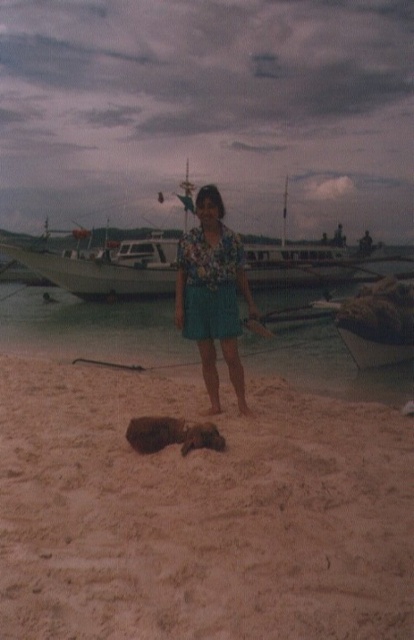
Is brown sandy beach at lower center thinner than sandy beach at center?

Yes.

How distant is brown sandy beach at lower center from sandy beach at center?

34.53 feet

Who is more distant from viewer, (89,531) or (159,324)?

Positioned behind is point (159,324).

You are a GUI agent. You are given a task and a screenshot of the screen. Output one action in this format:
    pyautogui.click(x=<x>, y=<y>)
    Task: Click on the brown sandy beach at lower center
    
    Given the screenshot: What is the action you would take?
    pyautogui.click(x=199, y=515)

In the scene shown: Is brown sandy beach at lower center shorter than white wooden boat at center?

Indeed, brown sandy beach at lower center has a lesser height compared to white wooden boat at center.

Is brown sandy beach at lower center in front of white wooden boat at center?

That is True.

Who is more distant from viewer, (161, 509) or (325, 269)?

Point (325, 269)

Find the location of `brown sandy beach at lower center`. brown sandy beach at lower center is located at coordinates (199, 515).

Is brown sandy beach at lower center to the right of floral fabric dress at center from the viewer's perspective?

In fact, brown sandy beach at lower center is to the left of floral fabric dress at center.

How far apart are brown sandy beach at lower center and floral fabric dress at center?

A distance of 3.26 meters exists between brown sandy beach at lower center and floral fabric dress at center.

Describe the element at coordinates (199, 515) in the screenshot. I see `brown sandy beach at lower center` at that location.

At what (x,y) coordinates should I click in order to perform the action: click on brown sandy beach at lower center. Please return your answer as a coordinate pair (x, y). Looking at the image, I should click on (199, 515).